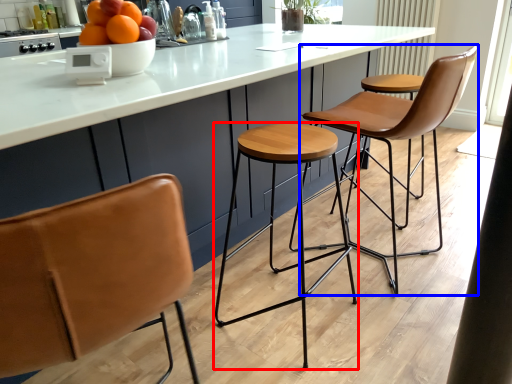
Question: Which object is closer to the camera taking this photo, stool (highlighted by a red box) or chair (highlighted by a blue box)?

Choices:
 (A) stool
 (B) chair

Answer: (A)